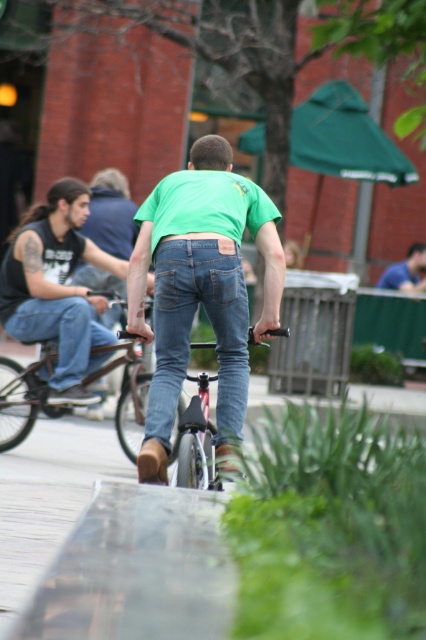
Question: Which object is positioned farthest from the matte black tank top at center?

Choices:
 (A) jeans at left
 (B) green matte t-shirt at center
 (C) denim jeans at center
 (D) blue jeans at center

Answer: (D)

Question: Is green matte t-shirt at center above denim jeans at center?

Choices:
 (A) no
 (B) yes

Answer: (B)

Question: Can you confirm if matte black tank top at center is positioned to the left of denim jeans at center?

Choices:
 (A) yes
 (B) no

Answer: (A)

Question: Which of the following is the farthest from the observer?

Choices:
 (A) (135, 376)
 (B) (74, 228)
 (C) (256, 337)

Answer: (B)

Question: Does green matte t-shirt at center have a smaller size compared to denim jeans at center?

Choices:
 (A) no
 (B) yes

Answer: (A)

Question: Based on their relative distances, which object is farther from the shiny black bicycle at center?

Choices:
 (A) matte black tank top at center
 (B) jeans at left
 (C) denim jeans at center

Answer: (C)